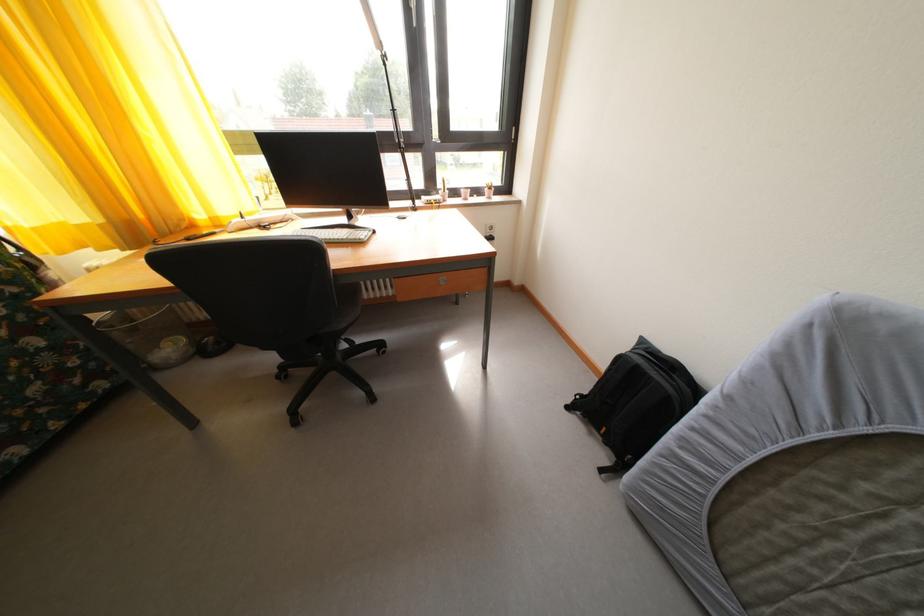
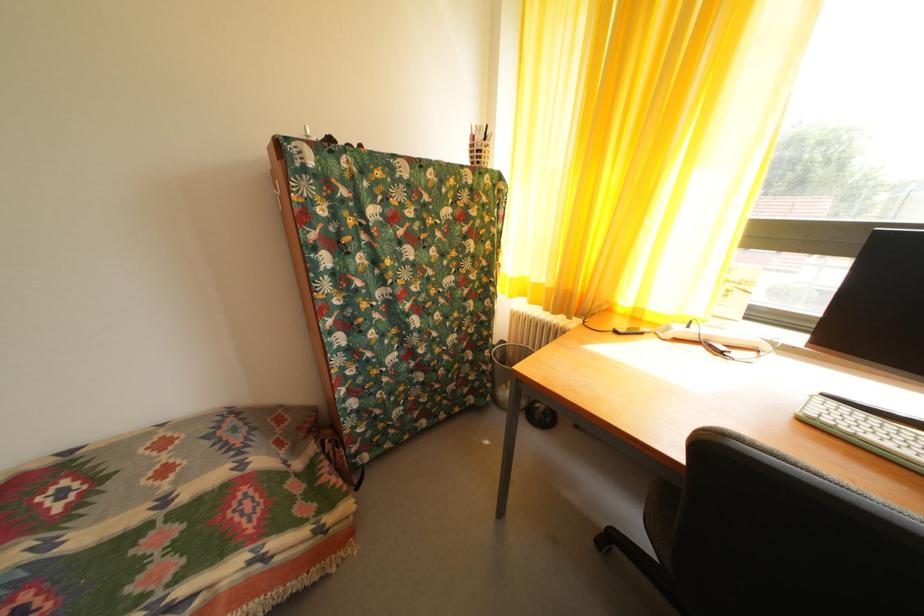
Question: The first image is from the beginning of the video and the second image is from the end. How did the camera likely rotate when shooting the video?

Choices:
 (A) Left
 (B) Right
 (C) Up
 (D) Down

Answer: (A)